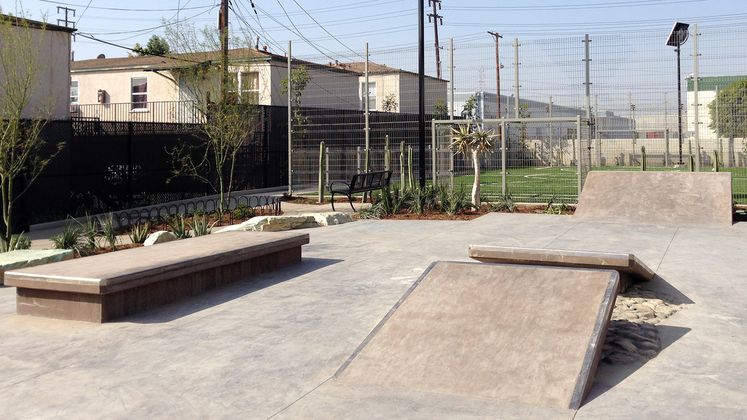
Find the location of `window`. window is located at coordinates (71, 92), (140, 87), (229, 85), (249, 88), (368, 95).